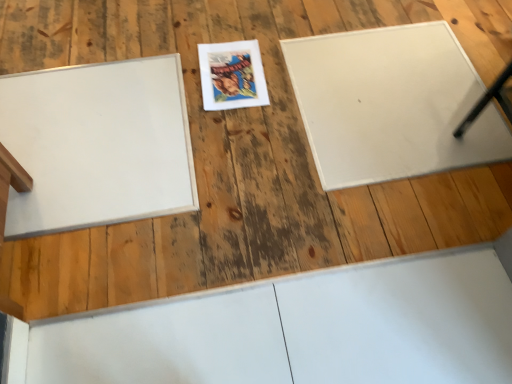
Locate an element on the screen. This screenshot has width=512, height=384. vacant area that lies between matte paper comic book at center and white matte board at upper right, which appears as the 1th bulletin board when viewed from the right is located at coordinates (271, 111).